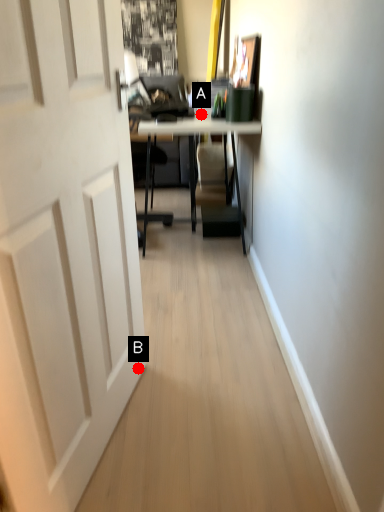
Question: Two points are circled on the image, labeled by A and B beside each circle. Which point appears closest to the camera in this image?

Choices:
 (A) A is closer
 (B) B is closer

Answer: (B)